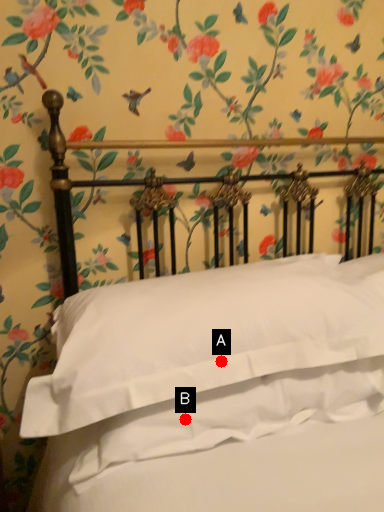
Question: Two points are circled on the image, labeled by A and B beside each circle. Which point is further to the camera?

Choices:
 (A) A is further
 (B) B is further

Answer: (A)